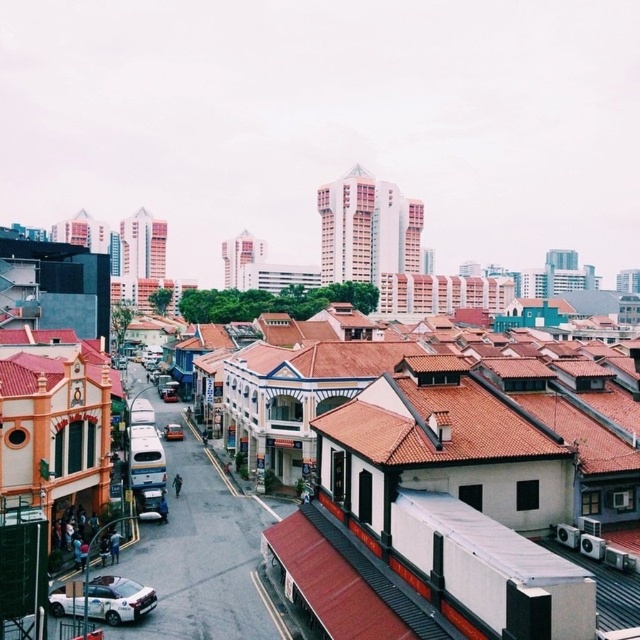
Question: Estimate the real-world distances between objects in this image. Which object is farther from the white glossy car at lower left?

Choices:
 (A) shiny red car at center
 (B) metallic silver car at center

Answer: (B)

Question: Does white glossy car at lower left have a smaller size compared to shiny red car at center?

Choices:
 (A) no
 (B) yes

Answer: (B)

Question: Which object is the closest to the white glossy car at lower left?

Choices:
 (A) metallic silver car at center
 (B) shiny red car at center

Answer: (B)

Question: Estimate the real-world distances between objects in this image. Which object is farther from the shiny red car at center?

Choices:
 (A) white glossy car at lower left
 (B) metallic silver car at center

Answer: (A)

Question: Considering the relative positions of white glossy car at lower left and shiny red car at center in the image provided, where is white glossy car at lower left located with respect to shiny red car at center?

Choices:
 (A) left
 (B) right

Answer: (B)

Question: Is white glossy car at lower left to the left of shiny red car at center from the viewer's perspective?

Choices:
 (A) yes
 (B) no

Answer: (B)